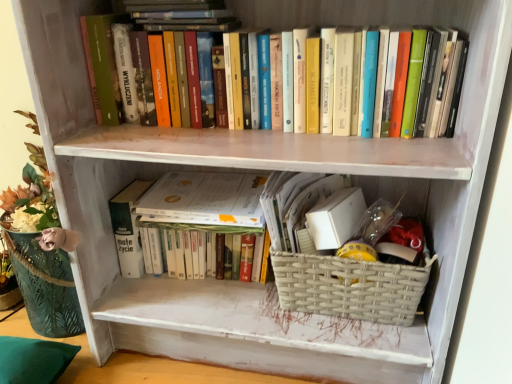
Question: Is hardcover books at upper center, which is the 2th book from bottom to top, inside the boundaries of woven beige basket at lower center, or outside?

Choices:
 (A) inside
 (B) outside

Answer: (B)

Question: Considering the positions of hardcover books at upper center, which ranks as the first book in top-to-bottom order, and woven beige basket at lower center in the image, is hardcover books at upper center, which ranks as the first book in top-to-bottom order, bigger or smaller than woven beige basket at lower center?

Choices:
 (A) big
 (B) small

Answer: (A)

Question: Based on their relative distances, which object is nearer to the white paper at center?

Choices:
 (A) woven beige basket at lower center
 (B) hardcover book at center, the second book when ordered from top to bottom
 (C) hardcover books at upper center, which is the 2th book from bottom to top
 (D) green fabric pillow at lower left

Answer: (B)

Question: Based on their relative distances, which object is nearer to the white paper at center?

Choices:
 (A) hardcover book at center, the 1th book in the bottom-to-top sequence
 (B) hardcover books at upper center, which is the 2th book from bottom to top
 (C) woven beige basket at lower center
 (D) green fabric pillow at lower left

Answer: (A)